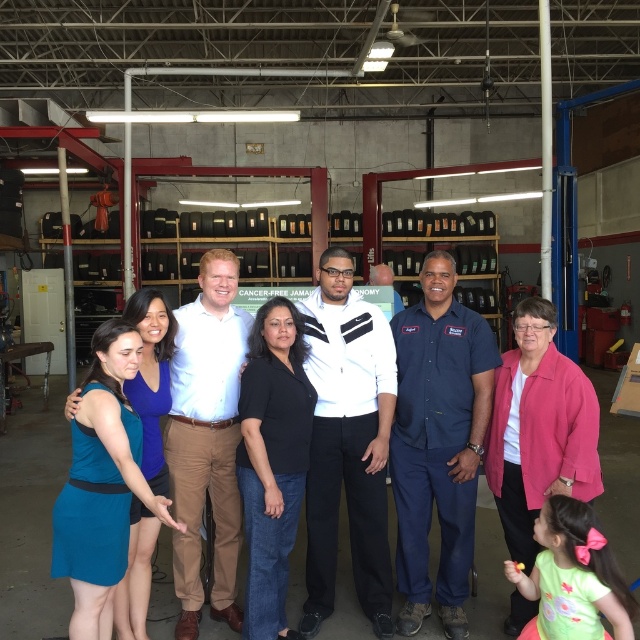
Question: Can you confirm if dark blue uniform at center is positioned to the right of white cotton shirt at center?

Choices:
 (A) yes
 (B) no

Answer: (A)

Question: Which of the following is the closest to the observer?

Choices:
 (A) (438, 292)
 (B) (195, 488)
 (C) (307, 531)

Answer: (A)

Question: Which point is closer to the camera?

Choices:
 (A) white cotton shirt at center
 (B) dark blue uniform at center
 (C) white matte jacket at center

Answer: (A)

Question: Which of the following is the closest to the observer?

Choices:
 (A) (424, 301)
 (B) (202, 292)

Answer: (B)

Question: Does white matte jacket at center have a lesser width compared to white cotton shirt at center?

Choices:
 (A) no
 (B) yes

Answer: (A)

Question: Is dark blue uniform at center behind white cotton shirt at center?

Choices:
 (A) yes
 (B) no

Answer: (A)